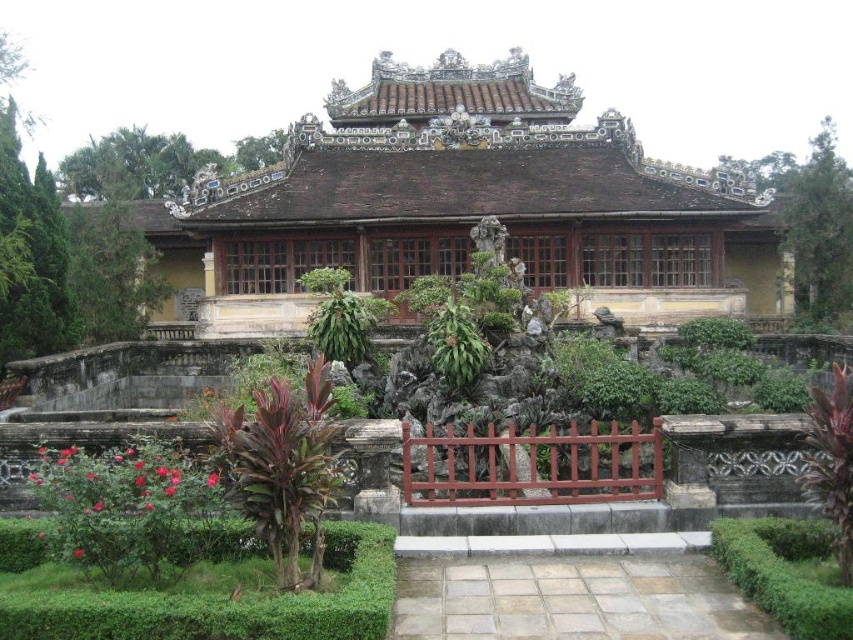
Question: Which of the following is the closest to the observer?

Choices:
 (A) (440, 323)
 (B) (119, 496)

Answer: (B)

Question: Which object is positioned closest to the red matte rose bush at lower left?

Choices:
 (A) green leafy bush at lower right
 (B) green leafy plant at center

Answer: (B)

Question: Which of the following is the closest to the observer?

Choices:
 (A) (210, 490)
 (B) (454, 349)

Answer: (A)

Question: Does red matte rose bush at lower left have a lesser width compared to green leafy bush at lower right?

Choices:
 (A) yes
 (B) no

Answer: (B)

Question: Is red matte rose bush at lower left wider than green leafy plant at center?

Choices:
 (A) yes
 (B) no

Answer: (A)

Question: Does red matte rose bush at lower left have a larger size compared to green leafy plant at center?

Choices:
 (A) yes
 (B) no

Answer: (A)